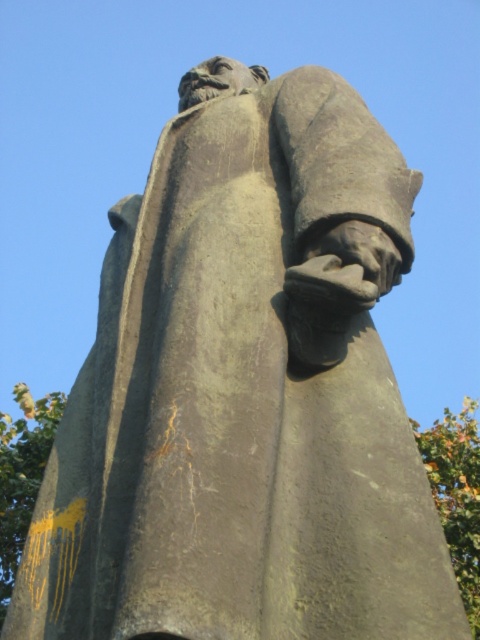
You are a photographer wanting to capture the statue with both the green leafy tree at center and the green leafy tree at right in the background. Can you position yourself so that both trees are fully visible without any obstruction?

The green leafy tree at right is behind the green leafy tree at center, so positioning yourself to the side of the statue where the trees are not overlapping would allow both to be visible in the background.

You are standing in front of the statue and notice two green leafy trees in the background. Which tree, the green leafy tree at center or the green leafy tree at right, is located to the left of the other?

The green leafy tree at center is positioned on the left side of green leafy tree at right.